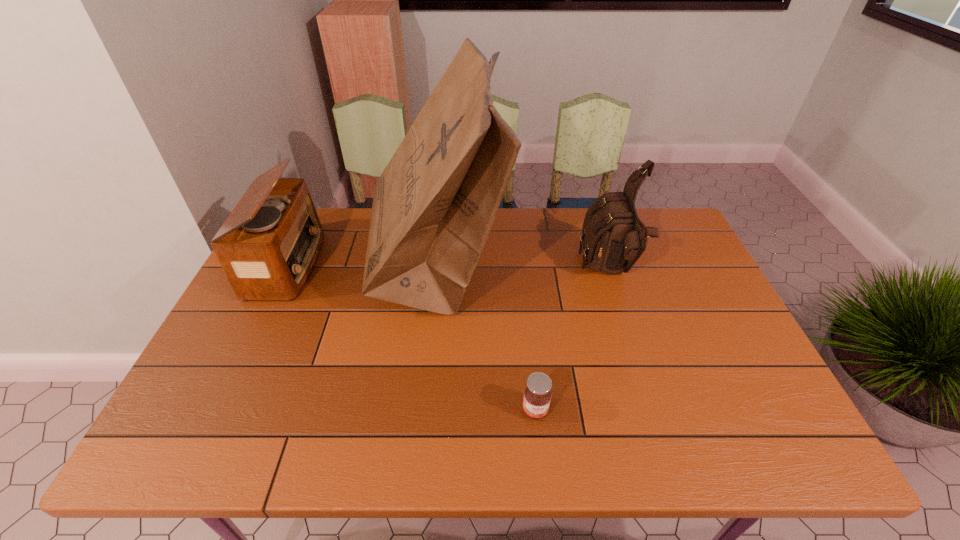
Find the location of a particular element. The height and width of the screenshot is (540, 960). grocery bag is located at coordinates (434, 205).

Locate an element on the screen. the third object from right to left is located at coordinates (434, 205).

Identify the location of shoulder bag. (613, 237).

At what (x,y) coordinates should I click in order to perform the action: click on the leftmost object. Please return your answer as a coordinate pair (x, y). The width and height of the screenshot is (960, 540). Looking at the image, I should click on (269, 244).

This screenshot has width=960, height=540. What are the coordinates of `the shortest object` in the screenshot? It's located at (537, 395).

Find the location of a particular element. This screenshot has width=960, height=540. jam is located at coordinates (537, 395).

In order to click on vacant space positioned 0.140m on the left of the grocery bag in this screenshot , I will do `click(324, 267)`.

At what (x,y) coordinates should I click in order to perform the action: click on vacant space situated 0.240m on the front-facing side of the rightmost object. Please return your answer as a coordinate pair (x, y). The width and height of the screenshot is (960, 540). Looking at the image, I should click on (502, 271).

The width and height of the screenshot is (960, 540). In order to click on vacant space located on the front-facing side of the rightmost object in this screenshot , I will do `click(532, 271)`.

I want to click on vacant space located 0.380m on the front-facing side of the rightmost object, so click(x=456, y=271).